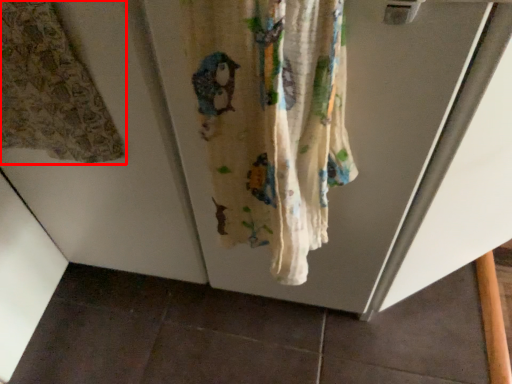
Question: Considering the relative positions of curtain (annotated by the red box) and curtain in the image provided, where is curtain (annotated by the red box) located with respect to the staircase?

Choices:
 (A) right
 (B) left

Answer: (B)